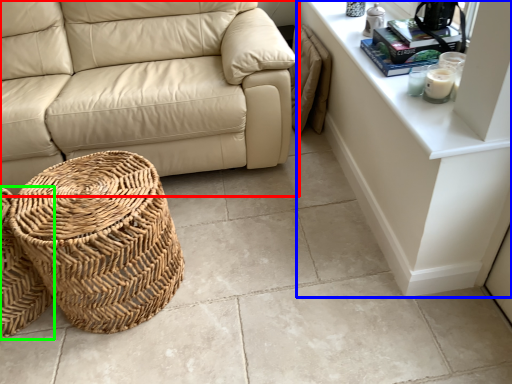
Question: Which object is positioned closest to studio couch (highlighted by a red box)? Select from dresser (highlighted by a blue box) and basket (highlighted by a green box).

Choices:
 (A) dresser
 (B) basket

Answer: (A)